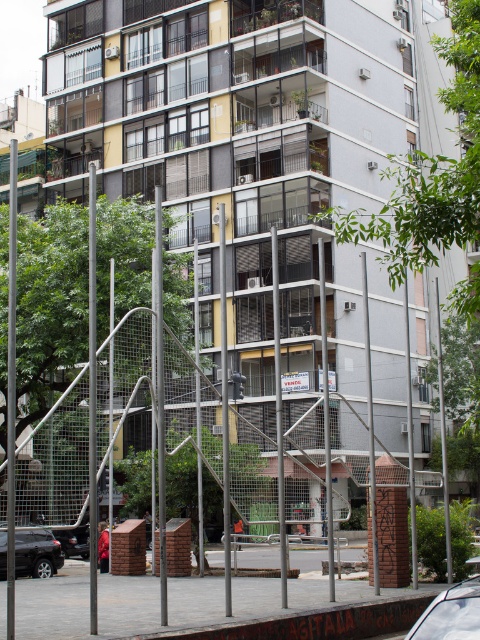
Is white glossy car at lower right shorter than black matte suv at lower left?

Yes.

Between white glossy car at lower right and black matte suv at lower left, which one is positioned lower?

black matte suv at lower left

Does point (431, 636) come in front of point (17, 545)?

That is True.

Find the location of `white glossy car at lower right`. white glossy car at lower right is located at coordinates (451, 614).

Does white glossy car at lower right have a greater height compared to black matte car at lower left?

No, white glossy car at lower right is not taller than black matte car at lower left.

Can you confirm if white glossy car at lower right is positioned to the right of black matte car at lower left?

Correct, you'll find white glossy car at lower right to the right of black matte car at lower left.

The width and height of the screenshot is (480, 640). What are the coordinates of `white glossy car at lower right` in the screenshot? It's located at (451, 614).

Between black matte suv at lower left and black matte car at lower left, which one is positioned higher?

black matte suv at lower left is higher up.

Who is more forward, (24,560) or (67,556)?

Positioned in front is point (24,560).

Find the location of `black matte suv at lower left`. black matte suv at lower left is located at coordinates (36, 554).